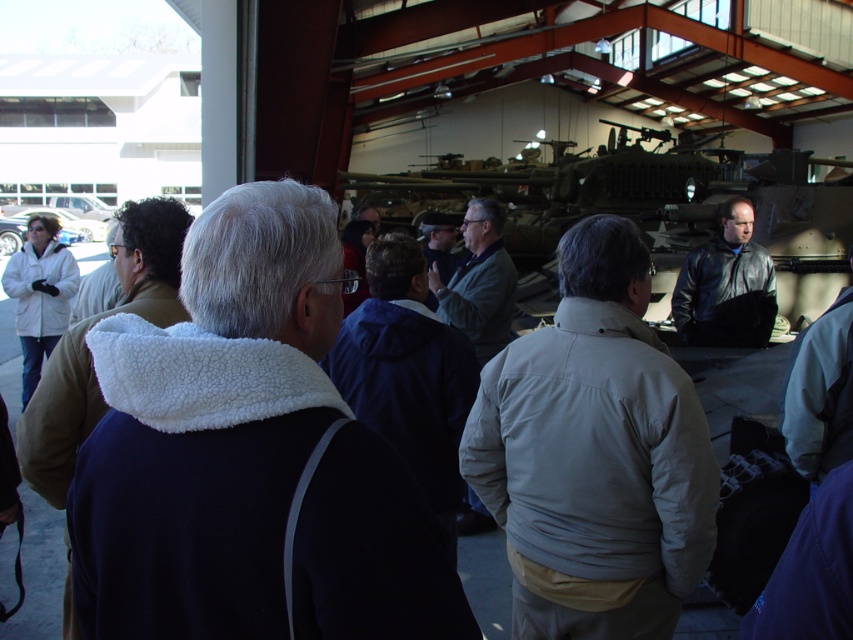
Which is below, light gray jacket at center or black leather jacket at center?

light gray jacket at center

Does light gray jacket at center come in front of black leather jacket at center?

Yes, it is in front of black leather jacket at center.

Is point (547, 342) positioned after point (752, 273)?

No.

Find the location of `light gray jacket at center`. light gray jacket at center is located at coordinates (595, 454).

Who is taller, light gray jacket at center or camouflage paint tank at center?

With more height is camouflage paint tank at center.

Where is `light gray jacket at center`? The height and width of the screenshot is (640, 853). light gray jacket at center is located at coordinates (595, 454).

Can you confirm if light gray jacket at center is positioned below white fleece jacket at left?

Yes, light gray jacket at center is below white fleece jacket at left.

Based on the photo, can you confirm if light gray jacket at center is smaller than white fleece jacket at left?

Incorrect, light gray jacket at center is not smaller in size than white fleece jacket at left.

Is point (676, 516) positioned after point (62, 316)?

That is False.

At what (x,y) coordinates should I click in order to perform the action: click on light gray jacket at center. Please return your answer as a coordinate pair (x, y). The width and height of the screenshot is (853, 640). Looking at the image, I should click on (595, 454).